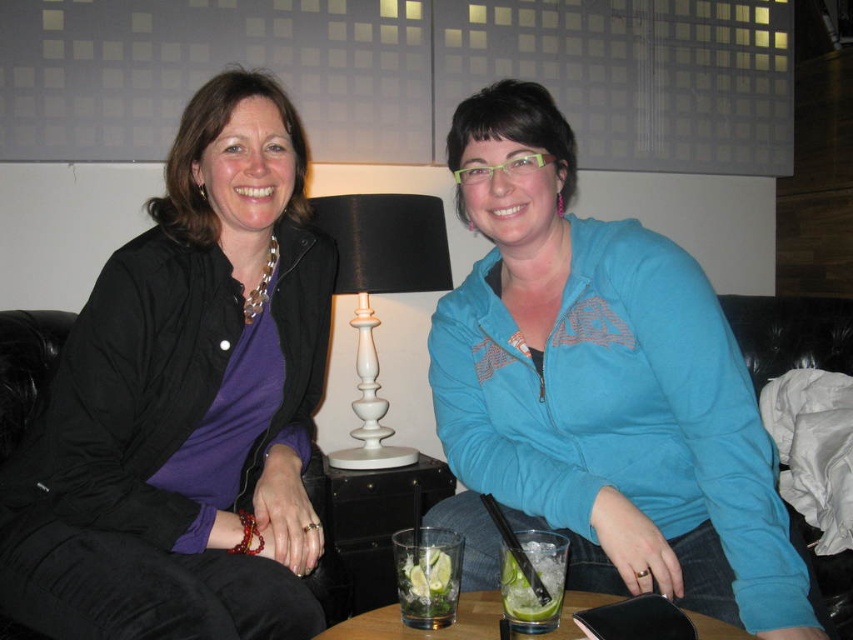
You are a bartender who needs to place a third glass between the clear glass with lime slices at lower center and the clear glass at center. Which glass should you move to the side to make space, considering their widths?

The clear glass with lime slices at lower center is wider than the clear glass at center. Therefore, you should move the clear glass at center to the side to make space for the third glass between them.